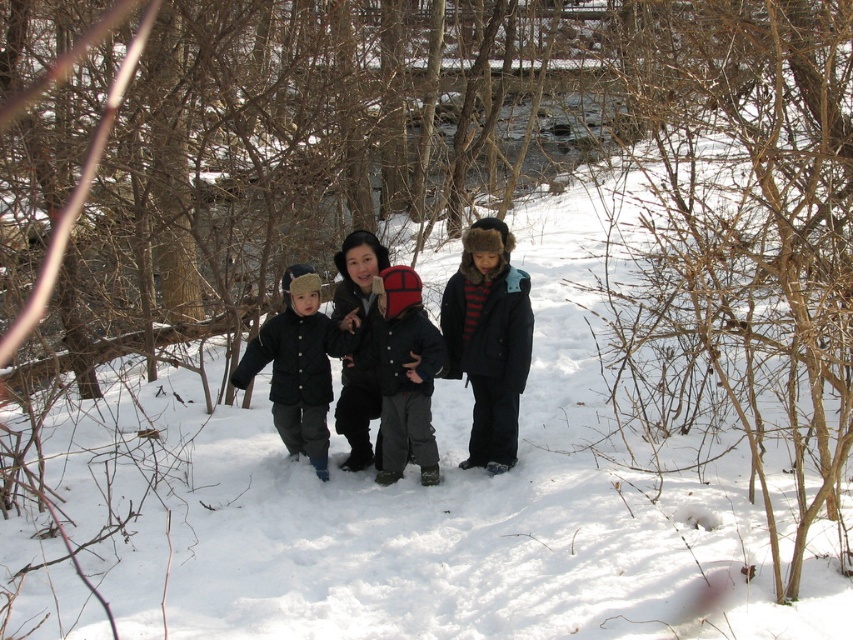
You are standing in the snowy landscape and want to walk from point A to point B. Point A is at coordinate point (477, 380) and point B is at coordinate point (381, 372). Which point is closer to you as you start walking?

Point A at coordinate point (477, 380) is closer to you because it is further to the viewer than point B at coordinate point (381, 372).

You are a photographer trying to capture a photo of the matte black coat at center and the red knit hat at center. Based on their positions, which object should you focus on first to ensure both are in sharp focus?

The red knit hat at center is behind the matte black coat at center, so you should focus on the matte black coat at center first to ensure both are in sharp focus.